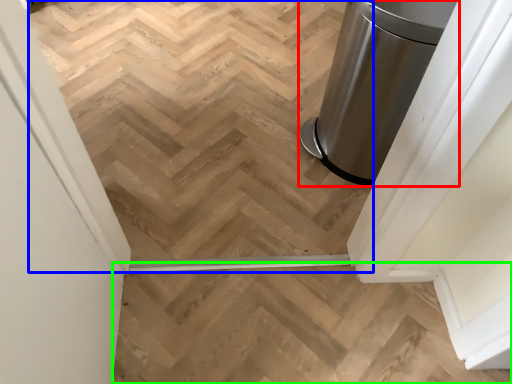
Question: Based on their relative distances, which object is nearer to waste container (highlighted by a red box)? Choose from stairwell (highlighted by a blue box) and stairs (highlighted by a green box).

Choices:
 (A) stairwell
 (B) stairs

Answer: (A)